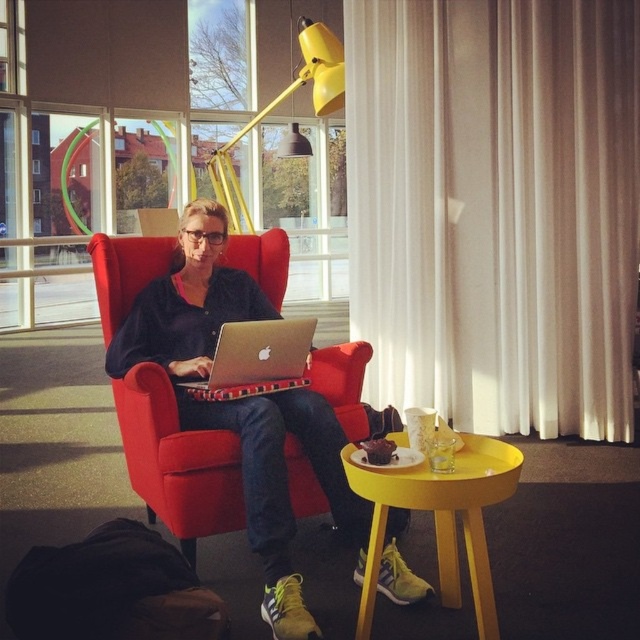
Question: Which of the following is the closest to the observer?

Choices:
 (A) white sheer curtain at center
 (B) yellow matte lamp at upper center
 (C) black fabric bag at lower left
 (D) yellow matte table at lower center

Answer: (D)

Question: Which point appears farthest from the camera in this image?

Choices:
 (A) (259, 365)
 (B) (336, 72)

Answer: (B)

Question: Is black fabric bag at lower left to the left of yellow matte lamp at upper center from the viewer's perspective?

Choices:
 (A) no
 (B) yes

Answer: (A)

Question: Is black fabric bag at lower left thinner than silver metallic laptop at center?

Choices:
 (A) yes
 (B) no

Answer: (B)

Question: Estimate the real-world distances between objects in this image. Which object is farther from the black fabric bag at lower left?

Choices:
 (A) yellow matte lamp at upper center
 (B) silver metallic laptop at center
 (C) white sheer curtain at center

Answer: (A)

Question: Is the position of white sheer curtain at center more distant than that of black fabric bag at lower left?

Choices:
 (A) yes
 (B) no

Answer: (A)